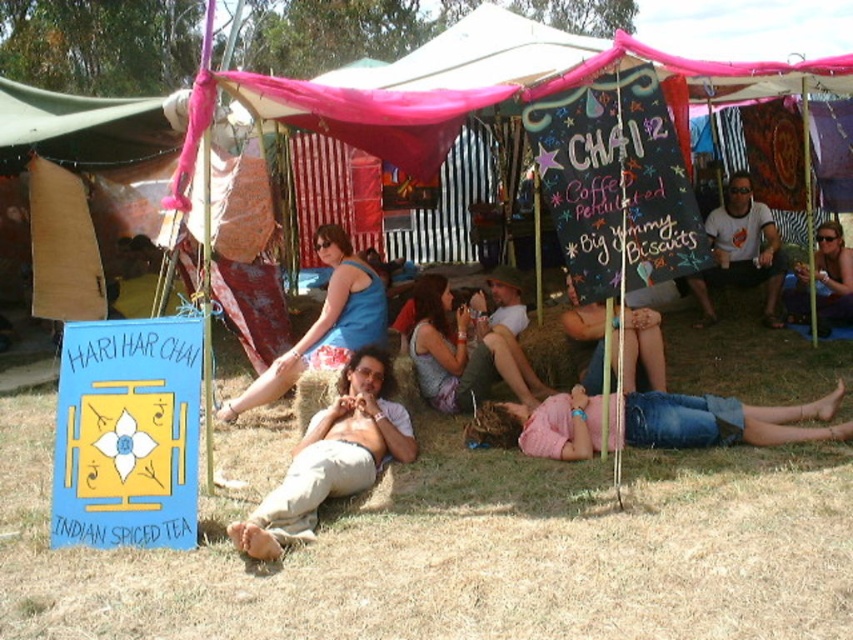
Which is above, blue fabric tank top at upper center or white t-shirt at center?

white t-shirt at center

Which is behind, point (270, 394) or point (775, 228)?

Point (775, 228)

Does point (316, 358) lie in front of point (767, 264)?

Yes, it is.

This screenshot has height=640, width=853. Identify the location of blue fabric tank top at upper center. (323, 323).

Who is positioned more to the left, tan cotton pants at center or denim shorts at center?

tan cotton pants at center

Which is below, tan cotton pants at center or denim shorts at center?

Positioned lower is tan cotton pants at center.

The height and width of the screenshot is (640, 853). What do you see at coordinates (331, 458) in the screenshot?
I see `tan cotton pants at center` at bounding box center [331, 458].

At what (x,y) coordinates should I click in order to perform the action: click on tan cotton pants at center. Please return your answer as a coordinate pair (x, y). Looking at the image, I should click on (331, 458).

Can you confirm if brown dry grass at lower center is positioned to the right of tan cotton pants at center?

Yes, brown dry grass at lower center is to the right of tan cotton pants at center.

Between brown dry grass at lower center and tan cotton pants at center, which one is positioned lower?

brown dry grass at lower center is lower down.

At what (x,y) coordinates should I click in order to perform the action: click on brown dry grass at lower center. Please return your answer as a coordinate pair (x, y). The height and width of the screenshot is (640, 853). Looking at the image, I should click on (457, 548).

Identify the location of brown dry grass at lower center. This screenshot has height=640, width=853. (457, 548).